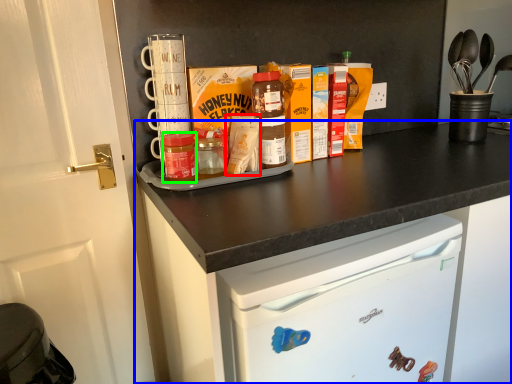
Question: Estimate the real-world distances between objects in this image. Which object is farther from cereal (highlighted by a red box), cabinetry (highlighted by a blue box) or bottle (highlighted by a green box)?

Choices:
 (A) cabinetry
 (B) bottle

Answer: (A)